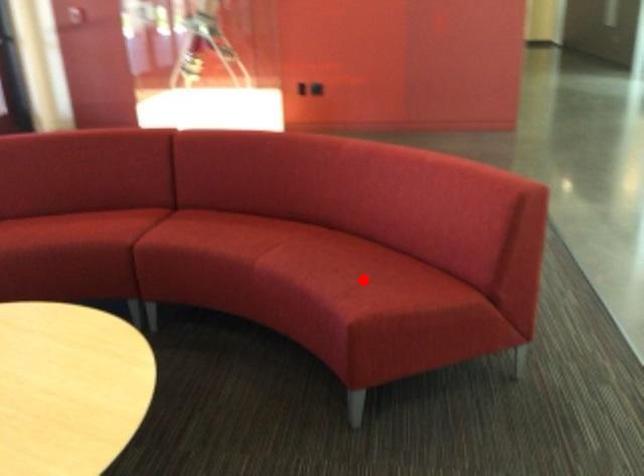
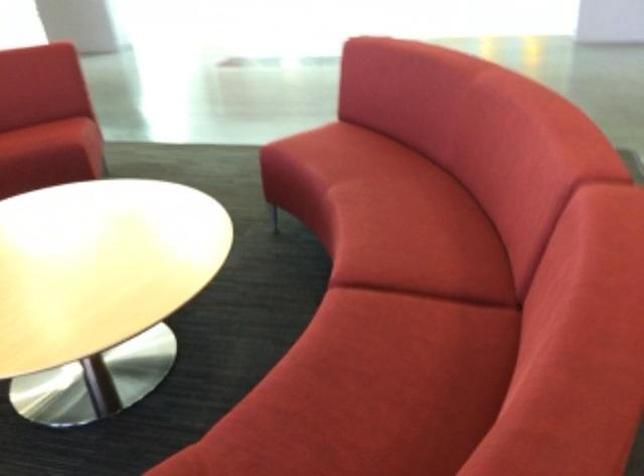
Question: A red point is marked in image1. In image2, is the corresponding 3D point closer to the camera or farther? Reply with the corresponding letter.

Choices:
 (A) The corresponding 3D point is closer.
 (B) The corresponding 3D point is farther.

Answer: (B)